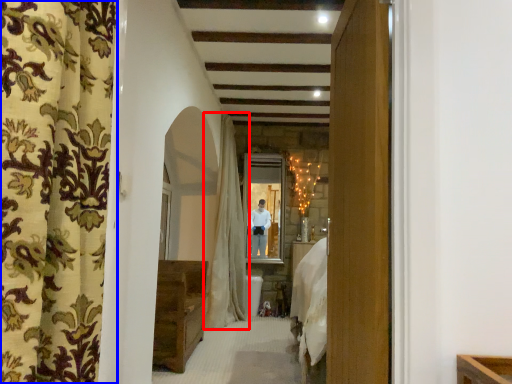
Question: Which point is further to the camera, curtain (highlighted by a red box) or curtain (highlighted by a blue box)?

Choices:
 (A) curtain
 (B) curtain

Answer: (A)